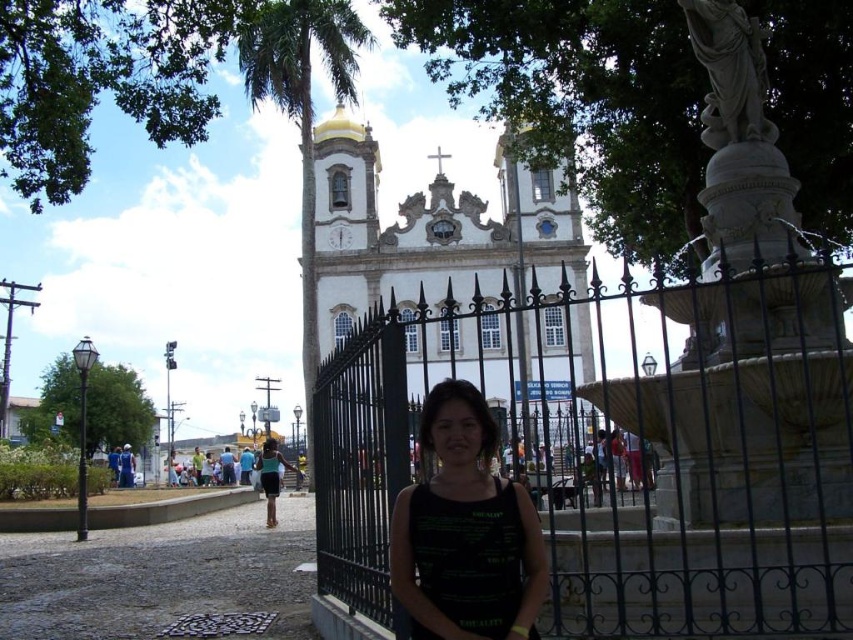
Question: Is the position of black wrought iron fence at center less distant than that of matte black tank top at center?

Choices:
 (A) no
 (B) yes

Answer: (B)

Question: Observing the image, what is the correct spatial positioning of white stone church at center in reference to matte black tank top at center?

Choices:
 (A) below
 (B) above

Answer: (B)

Question: Which object is farther from the camera taking this photo?

Choices:
 (A) black matte tank top at center
 (B) white stone church at center
 (C) matte black tank top at center

Answer: (C)

Question: Which object appears farthest from the camera in this image?

Choices:
 (A) matte black tank top at center
 (B) white stone church at center

Answer: (A)

Question: Does black wrought iron fence at center have a smaller size compared to matte black tank top at center?

Choices:
 (A) no
 (B) yes

Answer: (A)

Question: Which object appears farthest from the camera in this image?

Choices:
 (A) matte black tank top at center
 (B) white stone church at center

Answer: (A)